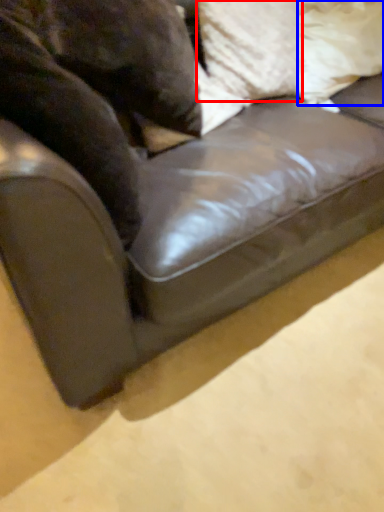
Question: Which point is further to the camera, pillow (highlighted by a red box) or pillow (highlighted by a blue box)?

Choices:
 (A) pillow
 (B) pillow

Answer: (B)